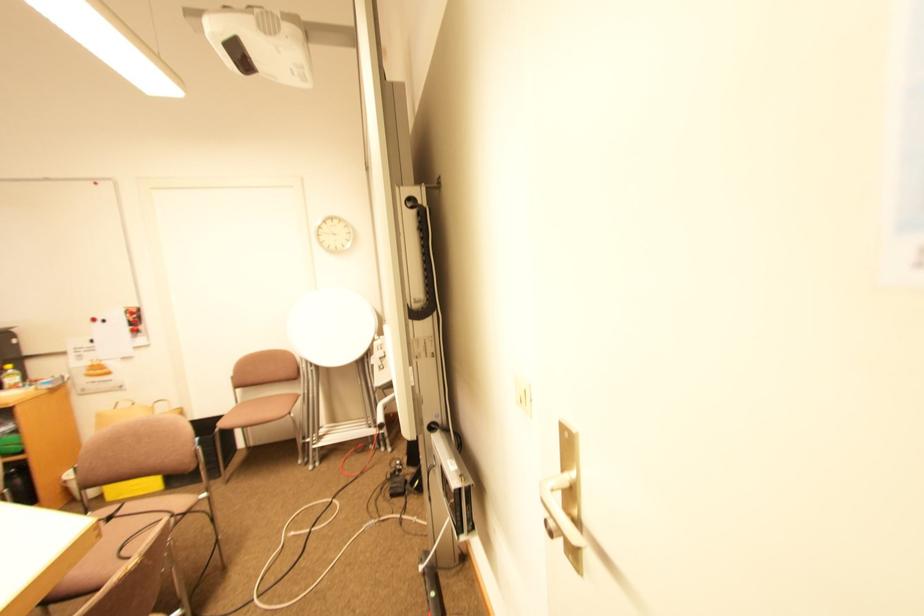
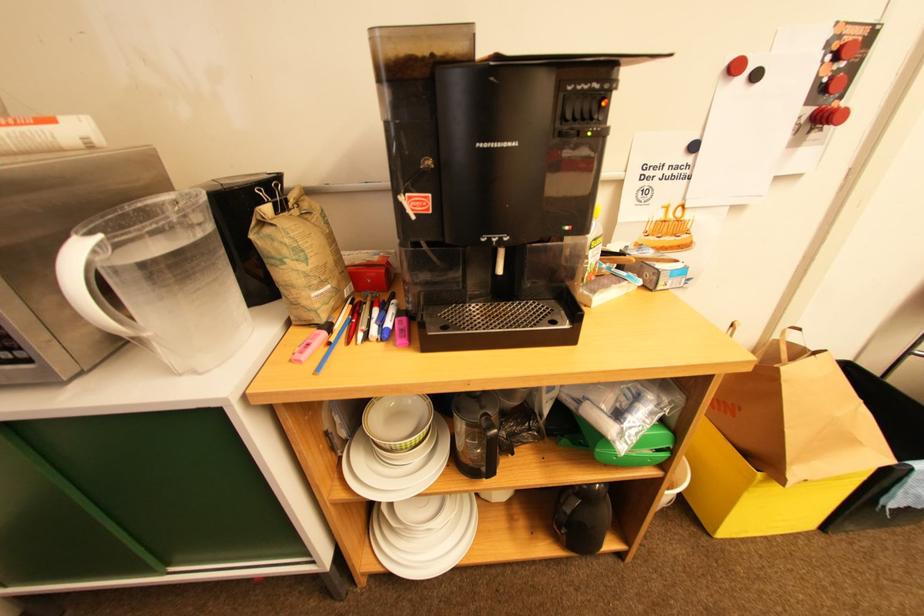
From the picture: In a continuous first-person perspective shot, in which direction is the camera moving?

The cameraman walked toward left, forward.